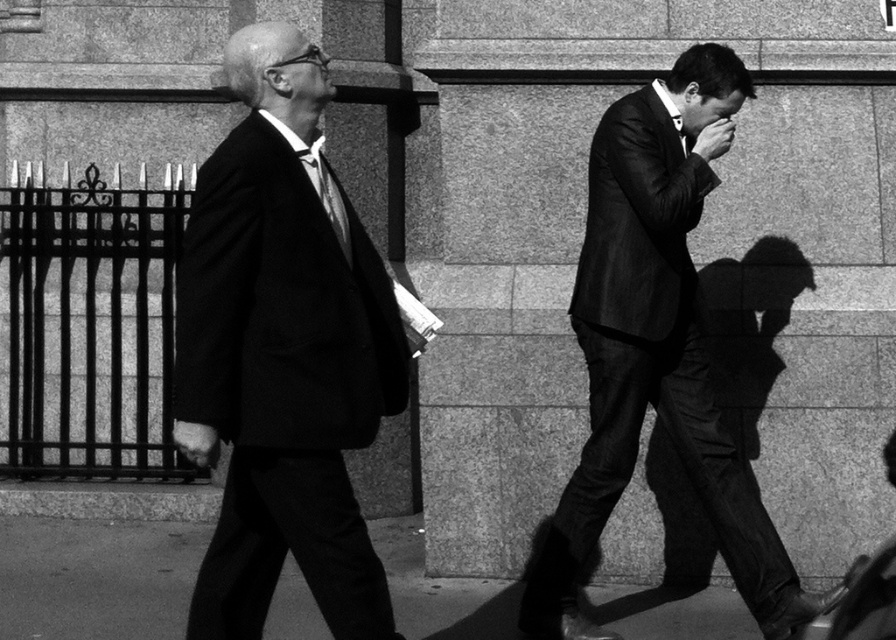
Question: Based on their relative distances, which object is nearer to the matte black suit at left?

Choices:
 (A) silky satin tie at center
 (B) smooth black suit at center
 (C) smooth concrete pavement at lower center

Answer: (A)

Question: Is matte black suit at left above smooth black suit at center?

Choices:
 (A) no
 (B) yes

Answer: (B)

Question: Can you confirm if smooth black suit at center is positioned above smooth concrete pavement at lower center?

Choices:
 (A) yes
 (B) no

Answer: (A)

Question: Which of the following is the closest to the observer?

Choices:
 (A) matte black suit at left
 (B) silky satin tie at center
 (C) smooth black suit at center
 (D) smooth concrete pavement at lower center

Answer: (A)

Question: In this image, where is smooth concrete pavement at lower center located relative to silky satin tie at center?

Choices:
 (A) below
 (B) above

Answer: (A)

Question: Which of these objects is positioned closest to the smooth black suit at center?

Choices:
 (A) silky satin tie at center
 (B) matte black suit at left
 (C) smooth concrete pavement at lower center

Answer: (B)